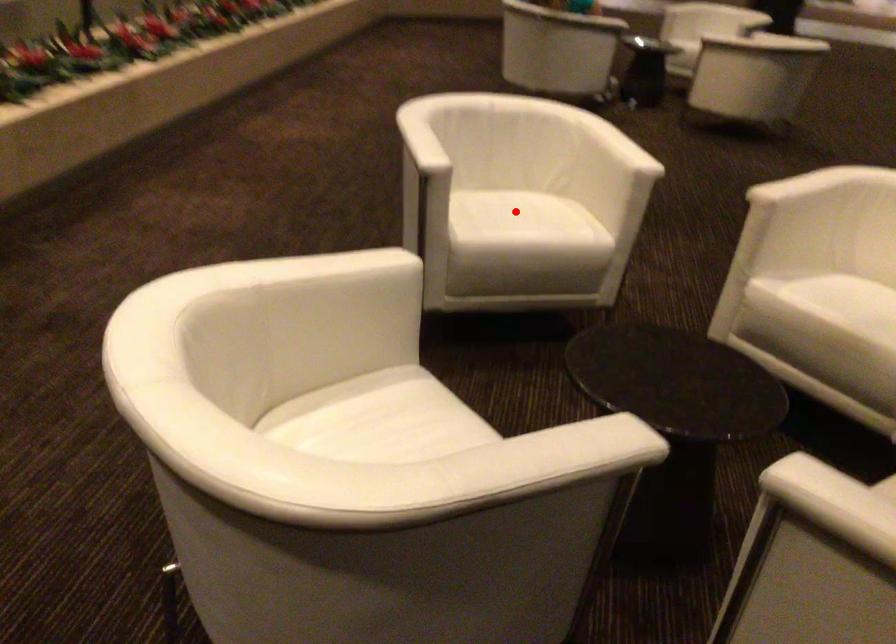
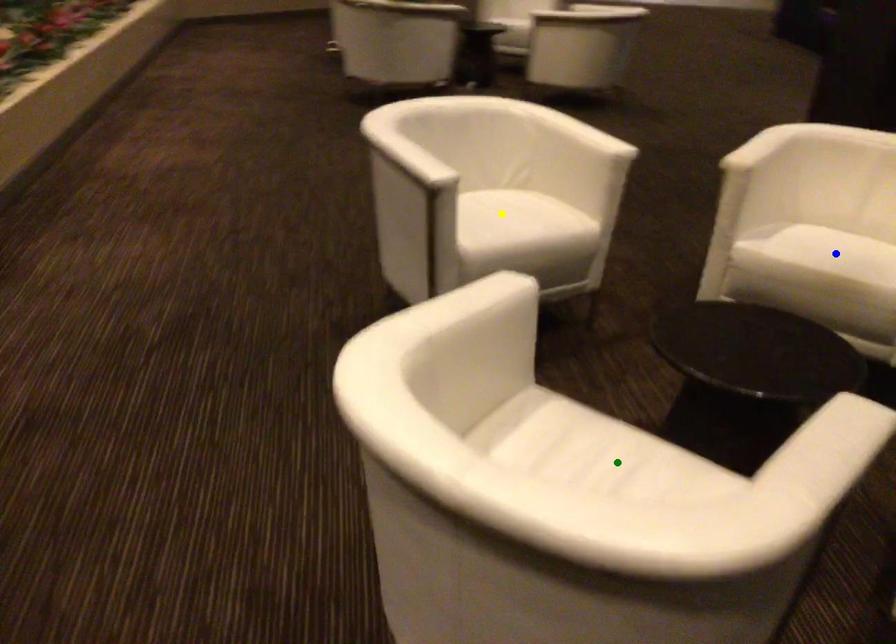
Question: I am providing you with two images of the same scene from different viewpoints. A red point is marked on the first image. You are given multiple points on the second image. Which point in image 2 represents the same 3d spot as the red point in image 1?

Choices:
 (A) green point
 (B) yellow point
 (C) blue point

Answer: (B)